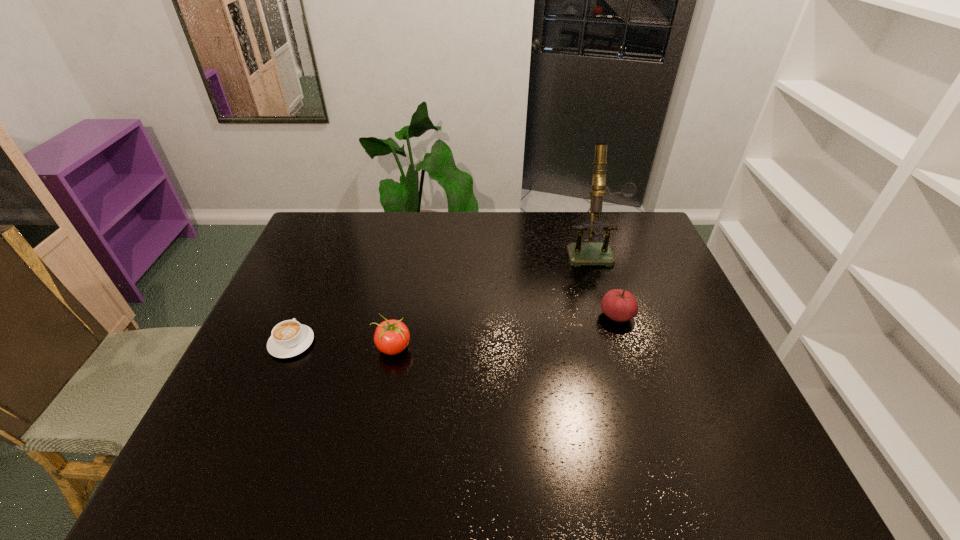
This screenshot has width=960, height=540. In order to click on vacant area that lies between the nearer tomato and the farther tomato in this screenshot , I will do `click(505, 332)`.

Locate an element on the screen. empty space that is in between the cappuccino and the left tomato is located at coordinates (343, 345).

Identify the location of free spot between the tallest object and the right tomato. The width and height of the screenshot is (960, 540). (605, 282).

Where is `the third closest object to the farthest object`? the third closest object to the farthest object is located at coordinates tap(289, 338).

Identify which object is located as the second nearest to the tallest object. Please provide its 2D coordinates. Your answer should be formatted as a tuple, i.e. [(x, y)], where the tuple contains the x and y coordinates of a point satisfying the conditions above.

[(391, 337)]

Where is `free spot that satisfies the following two spatial constraints: 1. at the eyepiece of the right tomato; 2. on the left side of the microscope`? This screenshot has width=960, height=540. free spot that satisfies the following two spatial constraints: 1. at the eyepiece of the right tomato; 2. on the left side of the microscope is located at coordinates (613, 315).

At what (x,y) coordinates should I click in order to perform the action: click on vacant area in the image that satisfies the following two spatial constraints: 1. at the eyepiece of the tallest object; 2. on the left side of the farther tomato. Please return your answer as a coordinate pair (x, y). The height and width of the screenshot is (540, 960). Looking at the image, I should click on (613, 315).

What are the coordinates of `vacant area that satisfies the following two spatial constraints: 1. at the eyepiece of the farthest object; 2. on the left side of the farther tomato` in the screenshot? It's located at (613, 315).

This screenshot has height=540, width=960. I want to click on vacant area that satisfies the following two spatial constraints: 1. on the back side of the farther tomato; 2. on the left side of the second object from left to right, so click(x=399, y=315).